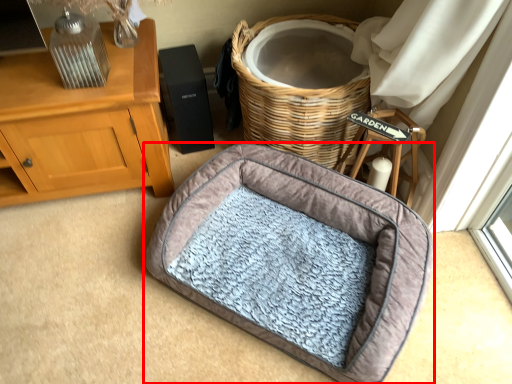
Question: From the image's perspective, what is the correct spatial relationship of dog bed (annotated by the red box) in relation to basket?

Choices:
 (A) below
 (B) above

Answer: (A)